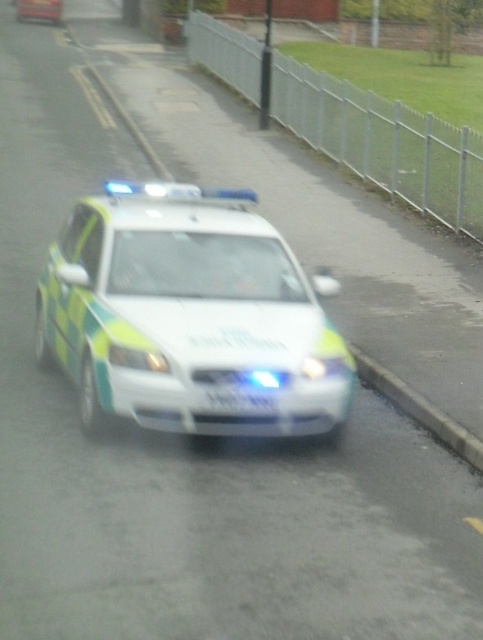
Does green/yellow painted police car at center appear on the left side of white plastic license plate at center?

Correct, you'll find green/yellow painted police car at center to the left of white plastic license plate at center.

Which of these two, green/yellow painted police car at center or white plastic license plate at center, stands taller?

green/yellow painted police car at center

Is point (151, 305) more distant than point (245, 392)?

Yes, point (151, 305) is behind point (245, 392).

At what (x,y) coordinates should I click in order to perform the action: click on green/yellow painted police car at center. Please return your answer as a coordinate pair (x, y). The height and width of the screenshot is (640, 483). Looking at the image, I should click on (187, 314).

Measure the distance between point (332, 428) and camera.

8.33 meters

Is point (169, 321) more distant than point (431, 404)?

No, it is not.

In order to click on green/yellow painted police car at center in this screenshot , I will do `click(187, 314)`.

Between point (411, 394) and point (235, 396), which one is positioned in front?

Positioned in front is point (235, 396).

Is concrete at lower right closer to camera compared to white plastic license plate at center?

That is False.

This screenshot has height=640, width=483. Find the location of `concrete at lower right`. concrete at lower right is located at coordinates (420, 410).